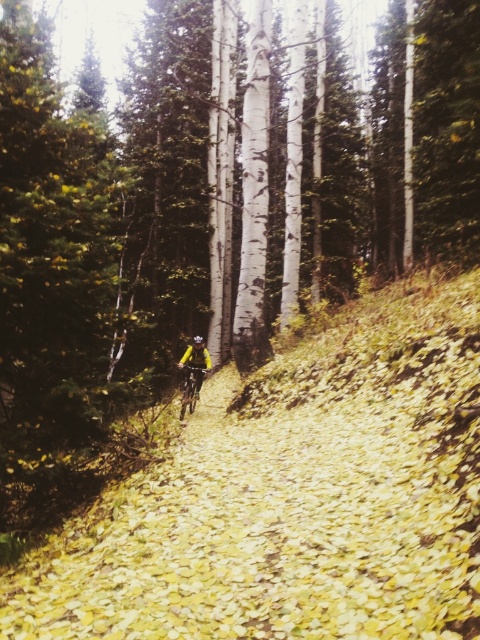
Question: Which of the following is the farthest from the observer?

Choices:
 (A) [x=192, y=369]
 (B) [x=197, y=374]

Answer: (B)

Question: Does yellow matte bicycle at center have a smaller size compared to yellow matte helmet at center?

Choices:
 (A) no
 (B) yes

Answer: (B)

Question: Is yellow matte bicycle at center closer to the viewer compared to yellow matte helmet at center?

Choices:
 (A) yes
 (B) no

Answer: (A)

Question: Among these objects, which one is farthest from the camera?

Choices:
 (A) yellow matte bicycle at center
 (B) yellow matte helmet at center

Answer: (B)

Question: Which point is closer to the camera?

Choices:
 (A) pyautogui.click(x=197, y=392)
 (B) pyautogui.click(x=180, y=419)
 (C) pyautogui.click(x=202, y=340)

Answer: (B)

Question: Does yellow matte bicycle at center appear on the right side of yellow matte helmet at center?

Choices:
 (A) yes
 (B) no

Answer: (A)